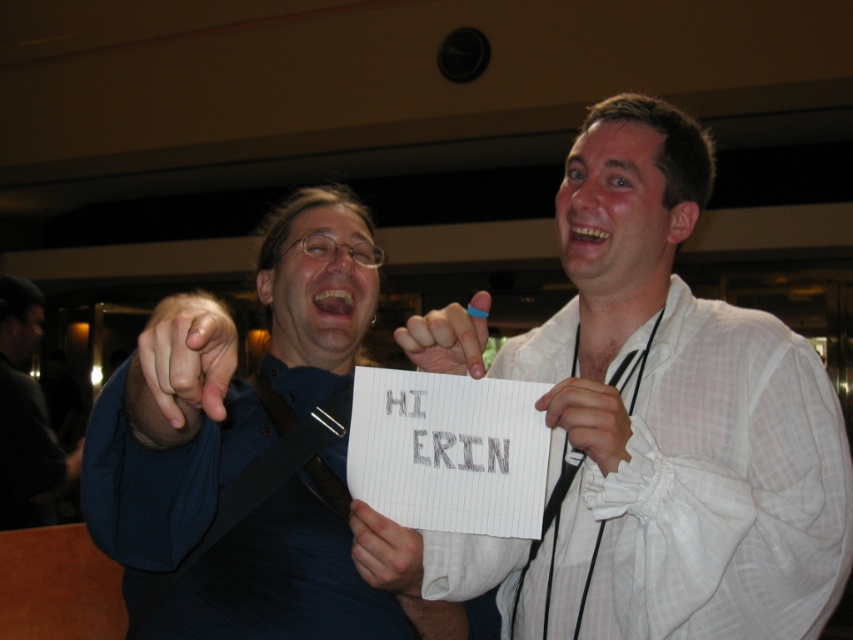
Question: Is black leather jacket at left wider than white fabric at center?

Choices:
 (A) no
 (B) yes

Answer: (B)

Question: Which point is farther to the camera?

Choices:
 (A) white checkered shirt at upper right
 (B) matte black hand at center
 (C) blue rubber band at center
 (D) white matte paper at center

Answer: (D)

Question: Which point is closer to the camera taking this photo?

Choices:
 (A) (157, 388)
 (B) (248, 424)

Answer: (A)

Question: Is matte black hand at center below white matte paper at center?

Choices:
 (A) no
 (B) yes

Answer: (A)

Question: Among these objects, which one is farthest from the camera?

Choices:
 (A) matte black hand at center
 (B) white matte paper at center
 (C) blue rubber band at center
 (D) white checkered shirt at upper right

Answer: (B)

Question: Does white checkered shirt at upper right appear under black leather jacket at left?

Choices:
 (A) yes
 (B) no

Answer: (B)